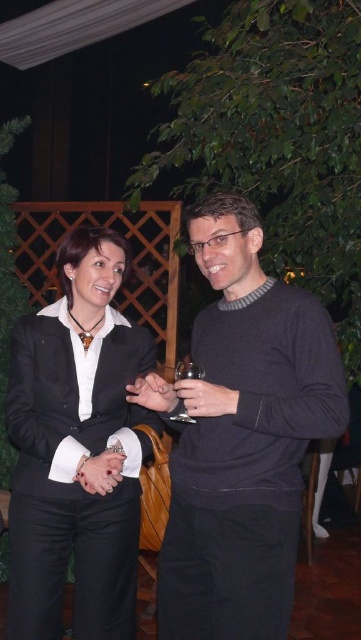
Does point (106, 228) lie behind point (176, 365)?

Yes, point (106, 228) is behind point (176, 365).

How far apart are matte black suit at center and transparent glass at center?

They are 47.94 centimeters apart.

Is point (15, 397) in front of point (196, 374)?

That is False.

Where is `matte black suit at center`? The image size is (361, 640). matte black suit at center is located at coordinates (76, 449).

Does dark gray sweater at center appear on the right side of transparent glass at center?

Correct, you'll find dark gray sweater at center to the right of transparent glass at center.

Is dark gray sweater at center bigger than transparent glass at center?

Yes, dark gray sweater at center is bigger than transparent glass at center.

Where is `dark gray sweater at center`? The width and height of the screenshot is (361, 640). dark gray sweater at center is located at coordinates (241, 436).

Does dark gray sweater at center have a greater width compared to matte black suit at center?

Yes.

Is dark gray sweater at center in front of matte black suit at center?

That is True.

Who is more forward, [244,209] or [63,374]?

Positioned in front is point [244,209].

The height and width of the screenshot is (640, 361). What are the coordinates of `dark gray sweater at center` in the screenshot? It's located at (241, 436).